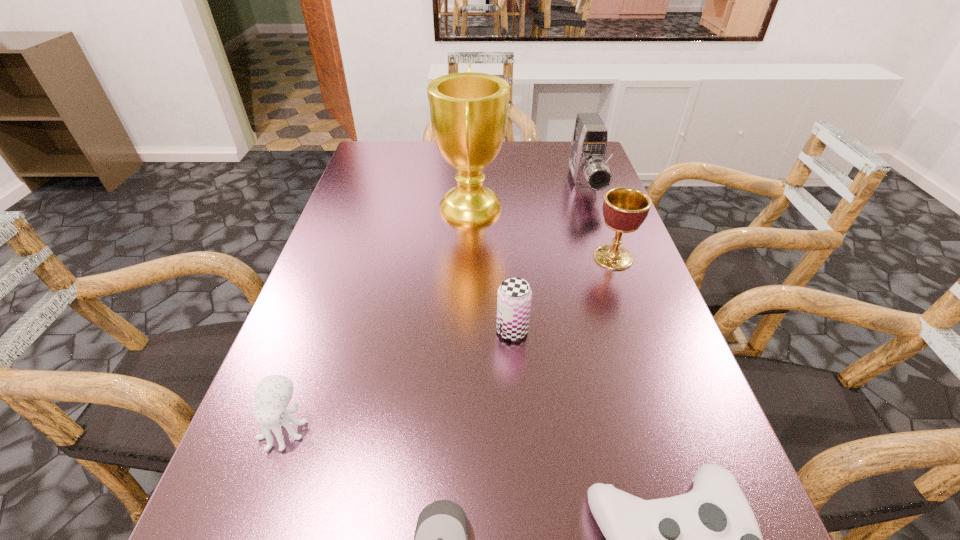
Locate an element on the screen. the tallest object is located at coordinates (469, 111).

The height and width of the screenshot is (540, 960). In order to click on camcorder in this screenshot , I will do `click(590, 172)`.

This screenshot has height=540, width=960. In order to click on chalice in this screenshot , I will do `click(624, 209)`.

Where is `the fourth tallest object`? the fourth tallest object is located at coordinates (514, 297).

The width and height of the screenshot is (960, 540). What are the coordinates of `beer can` in the screenshot? It's located at (514, 297).

Identify the location of the third nearest object. The image size is (960, 540). [x=273, y=394].

You are a GUI agent. You are given a task and a screenshot of the screen. Output one action in this format:
    pyautogui.click(x=<x>, y=<y>)
    Task: Click on the leftmost object
    This screenshot has width=960, height=540.
    Given the screenshot: What is the action you would take?
    pyautogui.click(x=273, y=394)

Identify the location of free space located 0.140m on the shiny surface of the tallest object. This screenshot has width=960, height=540. (558, 206).

Where is `free space located 0.120m at the front of the camcorder, highlighting the lens`? The width and height of the screenshot is (960, 540). free space located 0.120m at the front of the camcorder, highlighting the lens is located at coordinates (601, 232).

Find the location of a particular element. The height and width of the screenshot is (540, 960). free spot located on the left of the chalice is located at coordinates [x=448, y=258].